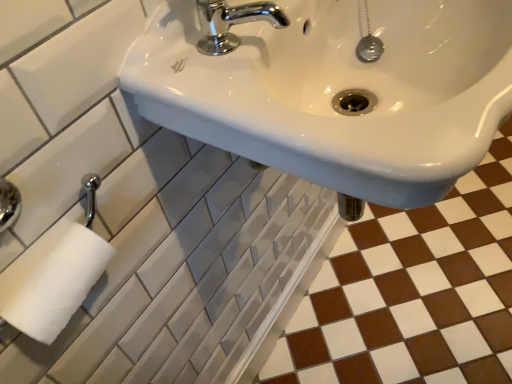
Question: From a real-world perspective, is chrome/metallic faucet at upper center located higher than white glossy sink at upper center?

Choices:
 (A) no
 (B) yes

Answer: (B)

Question: Are chrome/metallic faucet at upper center and white glossy sink at upper center making contact?

Choices:
 (A) yes
 (B) no

Answer: (B)

Question: Is chrome/metallic faucet at upper center looking in the opposite direction of white glossy sink at upper center?

Choices:
 (A) no
 (B) yes

Answer: (A)

Question: Can you confirm if chrome/metallic faucet at upper center is wider than white glossy sink at upper center?

Choices:
 (A) no
 (B) yes

Answer: (A)

Question: Does chrome/metallic faucet at upper center have a lesser width compared to white glossy sink at upper center?

Choices:
 (A) yes
 (B) no

Answer: (A)

Question: Is chrome/metallic faucet at upper center closer to the viewer compared to white glossy sink at upper center?

Choices:
 (A) yes
 (B) no

Answer: (B)

Question: Are brown glossy tile at lower right and chrome/metallic faucet at upper center far apart?

Choices:
 (A) no
 (B) yes

Answer: (B)

Question: Is brown glossy tile at lower right placed right next to chrome/metallic faucet at upper center?

Choices:
 (A) no
 (B) yes

Answer: (A)

Question: Is chrome/metallic faucet at upper center surrounded by brown glossy tile at lower right?

Choices:
 (A) yes
 (B) no

Answer: (B)

Question: Is brown glossy tile at lower right oriented towards chrome/metallic faucet at upper center?

Choices:
 (A) no
 (B) yes

Answer: (A)

Question: From the image's perspective, is brown glossy tile at lower right beneath chrome/metallic faucet at upper center?

Choices:
 (A) yes
 (B) no

Answer: (A)

Question: Is brown glossy tile at lower right wider than chrome/metallic faucet at upper center?

Choices:
 (A) yes
 (B) no

Answer: (A)

Question: From the image's perspective, is chrome/metallic faucet at upper center above brown glossy tile at lower right?

Choices:
 (A) yes
 (B) no

Answer: (A)